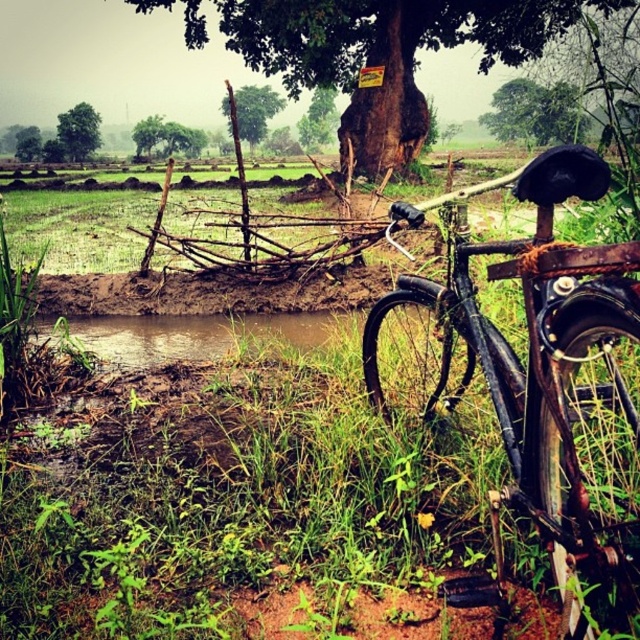
Question: Among these objects, which one is farthest from the camera?

Choices:
 (A) rusty metal bicycle at right
 (B) green matte tree at upper center

Answer: (B)

Question: Considering the real-world distances, which object is farthest from the green rough bark tree at center?

Choices:
 (A) green matte tree at upper center
 (B) green leafy tree at upper center
 (C) green rough bark tree at upper center

Answer: (C)

Question: Which point is farther from the camera taking this photo?

Choices:
 (A) (257, 134)
 (B) (408, 140)
 (C) (525, 129)
 (D) (580, 320)

Answer: (A)

Question: Can you confirm if rusty metal bicycle at right is positioned to the right of green leafy tree at upper left?

Choices:
 (A) yes
 (B) no

Answer: (A)

Question: Considering the relative positions of green matte tree at upper center and green rough bark tree at upper center in the image provided, where is green matte tree at upper center located with respect to green rough bark tree at upper center?

Choices:
 (A) above
 (B) below

Answer: (B)

Question: Does green matte tree at upper center appear on the right side of green leafy tree at upper left?

Choices:
 (A) no
 (B) yes

Answer: (B)